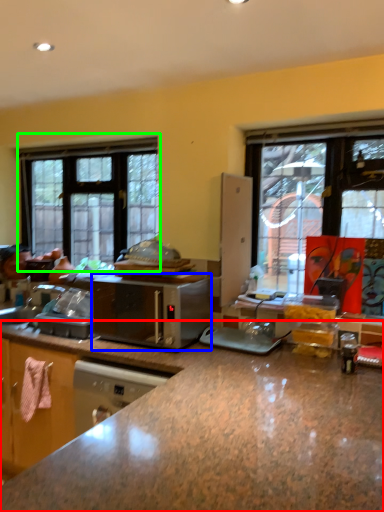
Question: Which is farther away from countertop (highlighted by a red box)? microwave oven (highlighted by a blue box) or window (highlighted by a green box)?

Choices:
 (A) microwave oven
 (B) window

Answer: (B)